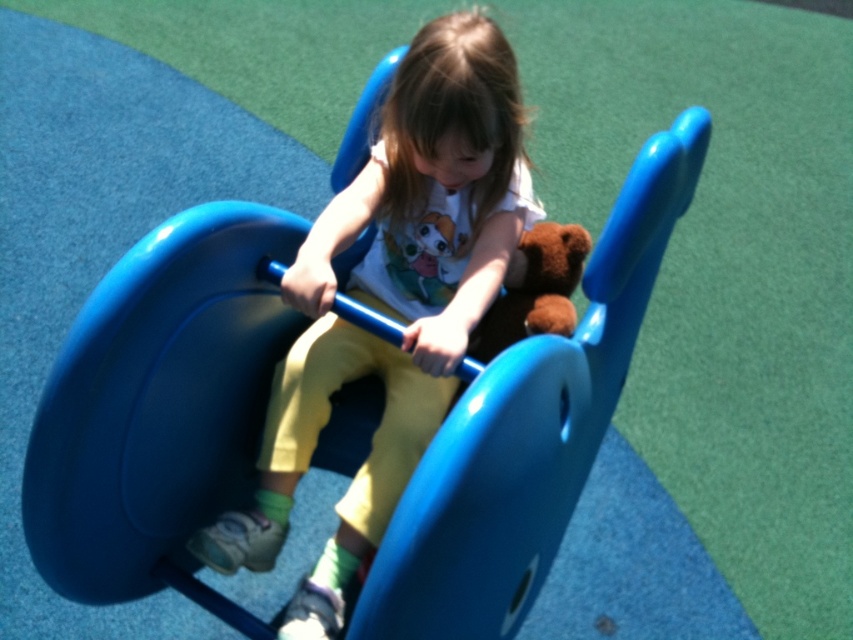
You are a parent at the playground. You see the blue glossy slide at center and the matte plastic child at center. Which object is bigger?

The blue glossy slide at center is larger in size than the matte plastic child at center.

You are designing a toy storage box that needs to accommodate both the matte plastic child at center and the brown plush at center. If the box must be sized to fit the wider object, which object determines the minimum required width of the box?

The matte plastic child at center determines the minimum required width of the box because its width is larger than the brown plush at center.

You are a parent watching your child play on the playground. You see the blue glossy slide at center and the brown plush at center. Which object is closer to you?

The blue glossy slide at center is closer to you than the brown plush at center.